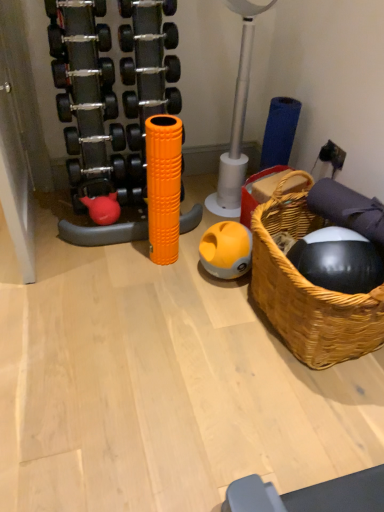
Question: From the image's perspective, is woven wood basket at right located beneath yellow matte ball at center?

Choices:
 (A) yes
 (B) no

Answer: (A)

Question: Is woven wood basket at right to the right of yellow matte ball at center from the viewer's perspective?

Choices:
 (A) no
 (B) yes

Answer: (B)

Question: From a real-world perspective, is woven wood basket at right physically below yellow matte ball at center?

Choices:
 (A) no
 (B) yes

Answer: (A)

Question: Is woven wood basket at right positioned beyond the bounds of yellow matte ball at center?

Choices:
 (A) no
 (B) yes

Answer: (B)

Question: Does woven wood basket at right have a lesser width compared to yellow matte ball at center?

Choices:
 (A) no
 (B) yes

Answer: (A)

Question: Does woven wood basket at right appear on the left side of yellow matte ball at center?

Choices:
 (A) no
 (B) yes

Answer: (A)

Question: Are orange foam roller at center and woven wood basket at right making contact?

Choices:
 (A) no
 (B) yes

Answer: (A)

Question: Is woven wood basket at right completely or partially inside orange foam roller at center?

Choices:
 (A) no
 (B) yes

Answer: (A)

Question: Can you confirm if orange foam roller at center is taller than woven wood basket at right?

Choices:
 (A) no
 (B) yes

Answer: (B)

Question: Is orange foam roller at center bigger than woven wood basket at right?

Choices:
 (A) yes
 (B) no

Answer: (B)

Question: From the image's perspective, would you say orange foam roller at center is shown under woven wood basket at right?

Choices:
 (A) yes
 (B) no

Answer: (B)

Question: Does orange foam roller at center lie behind woven wood basket at right?

Choices:
 (A) no
 (B) yes

Answer: (B)

Question: From a real-world perspective, is orange foam roller at center positioned under yellow matte ball at center based on gravity?

Choices:
 (A) no
 (B) yes

Answer: (A)